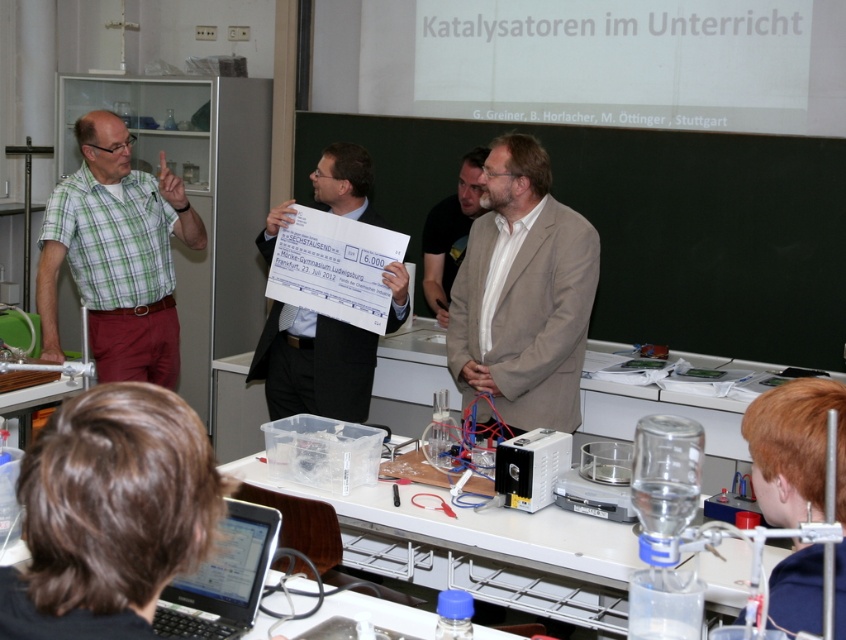
You are a student in the classroom and need to place a small notebook on the desk. The notebook is 15 cm wide. Can the silver metallic laptop at lower left be moved to make space?

The position of silver metallic laptop at lower left is at point (222, 579). Without knowing the desk dimensions or the notebook placement requirements, it is impossible to determine if moving the laptop would provide sufficient space.

You are a student in the classroom and need to hand in an assignment. You have a folder on your desk and see the silver metallic laptop at lower left and the light brown suit at center. Which object is closer to the floor?

The silver metallic laptop at lower left is closer to the floor because it is positioned below the light brown suit at center.

You are a student sitting in the classroom and want to know which object is wider between the blackboard at center and the green checkered shirt at left. Can you determine this based on the information provided?

The blackboard at center might be wider than green checkered shirt at left according to the description.